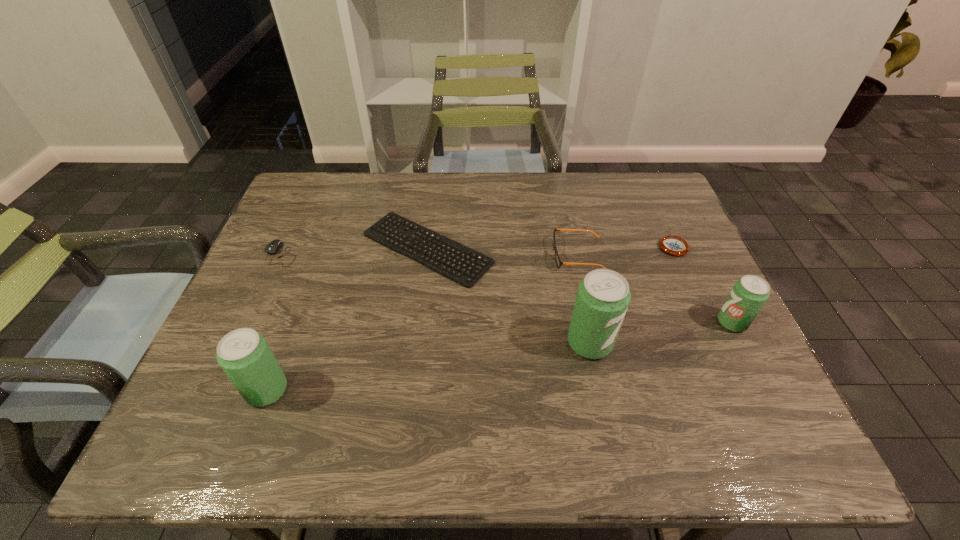
Choose which object is the fifth nearest neighbor to the sixth object from right to left. Please provide its 2D coordinates. Your answer should be formatted as a tuple, i.e. [(x, y)], where the tuple contains the x and y coordinates of a point satisfying the conditions above.

[(749, 294)]

Locate which object ranks third in proximity to the shortest soda. Please provide its 2D coordinates. Your answer should be formatted as a tuple, i.e. [(x, y)], where the tuple contains the x and y coordinates of a point satisfying the conditions above.

[(603, 296)]

Select which soda appears as the second closest to the rightmost soda. Please provide its 2D coordinates. Your answer should be formatted as a tuple, i.e. [(x, y)], where the tuple contains the x and y coordinates of a point satisfying the conditions above.

[(245, 356)]

You are a GUI agent. You are given a task and a screenshot of the screen. Output one action in this format:
    pyautogui.click(x=<x>, y=<y>)
    Task: Click on the soda that stands as the closest to the fifth shortest object
    
    Given the screenshot: What is the action you would take?
    pyautogui.click(x=603, y=296)

At what (x,y) coordinates should I click in order to perform the action: click on free space that satisfies the following two spatial constraints: 1. on the back side of the shortest object; 2. on the right side of the compass. Please return your answer as a coordinate pair (x, y). Image resolution: width=960 pixels, height=540 pixels. Looking at the image, I should click on (427, 247).

Identify the location of free location that satisfies the following two spatial constraints: 1. on the front side of the compass; 2. on the front-facing side of the fourth shortest object. (677, 255).

I want to click on vacant space that satisfies the following two spatial constraints: 1. on the back side of the second tallest soda; 2. on the left side of the fifth object from right to left, so click(320, 248).